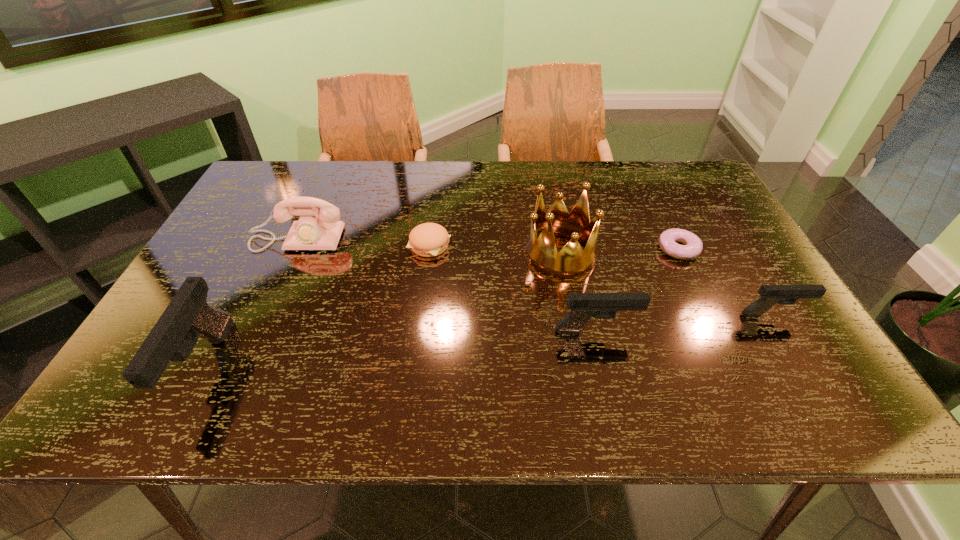
The image size is (960, 540). What are the coordinates of `the leftmost pistol` in the screenshot? It's located at (188, 316).

This screenshot has width=960, height=540. What are the coordinates of `the second tallest pistol` in the screenshot? It's located at (583, 306).

Where is `the second pistol from left to right`? The height and width of the screenshot is (540, 960). the second pistol from left to right is located at coordinates (583, 306).

Where is `the shortest pistol`? the shortest pistol is located at coordinates (770, 295).

The height and width of the screenshot is (540, 960). In order to click on the rightmost pistol in this screenshot , I will do [770, 295].

Identify the location of patty. (428, 239).

The width and height of the screenshot is (960, 540). What are the coordinates of `the second shortest object` in the screenshot? It's located at (428, 239).

Locate an element on the screen. the second object from right to left is located at coordinates (693, 246).

You are a GUI agent. You are given a task and a screenshot of the screen. Output one action in this format:
    pyautogui.click(x=<x>, y=<y>)
    Task: Click on the doughnut
    
    Given the screenshot: What is the action you would take?
    [x=693, y=246]

You are a GUI agent. You are given a task and a screenshot of the screen. Output one action in this format:
    pyautogui.click(x=<x>, y=<y>)
    Task: Click on the telephone
    Image resolution: width=960 pixels, height=540 pixels.
    Given the screenshot: What is the action you would take?
    pyautogui.click(x=311, y=232)